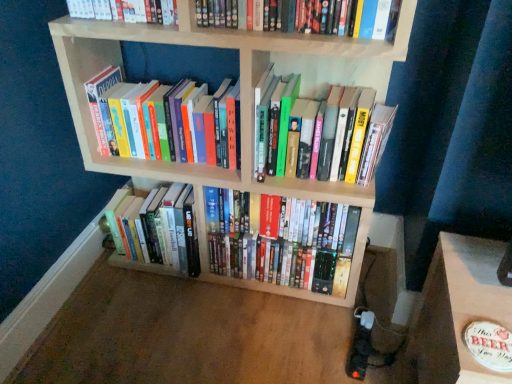
Question: Which direction should I rotate to look at hardcover books at center, which is counted as the 4th book, starting from the top, — up or down?

Choices:
 (A) down
 (B) up

Answer: (A)

Question: Is hardcover book at upper center, placed as the 5th book when sorted from bottom to top, at the back of hardcover books at center, the 2th book ordered from the bottom?

Choices:
 (A) no
 (B) yes

Answer: (A)

Question: Can we say hardcover books at center, the 2th book ordered from the bottom, lies outside hardcover book at upper center, the first book when ordered from top to bottom?

Choices:
 (A) no
 (B) yes

Answer: (B)

Question: Is hardcover books at center, the 2th book ordered from the bottom, far from hardcover book at upper center, placed as the 5th book when sorted from bottom to top?

Choices:
 (A) no
 (B) yes

Answer: (A)

Question: Is hardcover books at center, which is counted as the 4th book, starting from the top, next to hardcover book at upper center, the first book when ordered from top to bottom?

Choices:
 (A) no
 (B) yes

Answer: (A)

Question: Considering the relative positions of hardcover books at center, the 2th book ordered from the bottom, and hardcover book at upper center, the first book when ordered from top to bottom, in the image provided, is hardcover books at center, the 2th book ordered from the bottom, to the right of hardcover book at upper center, the first book when ordered from top to bottom, from the viewer's perspective?

Choices:
 (A) no
 (B) yes

Answer: (A)

Question: Can you confirm if hardcover books at center, which is counted as the 4th book, starting from the top, is positioned to the left of hardcover book at upper center, the first book when ordered from top to bottom?

Choices:
 (A) no
 (B) yes

Answer: (B)

Question: Is shiny plastic dvds at center, placed as the 5th book when sorted from top to bottom, closer to the viewer compared to hardcover books at left, the 2th book when ordered from top to bottom?

Choices:
 (A) no
 (B) yes

Answer: (A)

Question: Is hardcover books at left, acting as the 4th book starting from the bottom, a part of shiny plastic dvds at center, placed as the 5th book when sorted from top to bottom?

Choices:
 (A) no
 (B) yes

Answer: (A)

Question: From the image's perspective, is shiny plastic dvds at center, placed as the 5th book when sorted from top to bottom, on hardcover books at left, the 2th book when ordered from top to bottom?

Choices:
 (A) no
 (B) yes

Answer: (A)

Question: Can you confirm if shiny plastic dvds at center, the 1th book positioned from the bottom, is thinner than hardcover books at left, the 2th book when ordered from top to bottom?

Choices:
 (A) yes
 (B) no

Answer: (B)

Question: Is shiny plastic dvds at center, the 1th book positioned from the bottom, bigger than hardcover books at left, the 2th book when ordered from top to bottom?

Choices:
 (A) yes
 (B) no

Answer: (A)

Question: Considering the relative sizes of shiny plastic dvds at center, placed as the 5th book when sorted from top to bottom, and hardcover books at left, the 2th book when ordered from top to bottom, in the image provided, is shiny plastic dvds at center, placed as the 5th book when sorted from top to bottom, wider than hardcover books at left, the 2th book when ordered from top to bottom,?

Choices:
 (A) no
 (B) yes

Answer: (B)

Question: Is hardcover books at left, acting as the 4th book starting from the bottom, with shiny plastic dvds at center, placed as the 5th book when sorted from top to bottom?

Choices:
 (A) no
 (B) yes

Answer: (A)